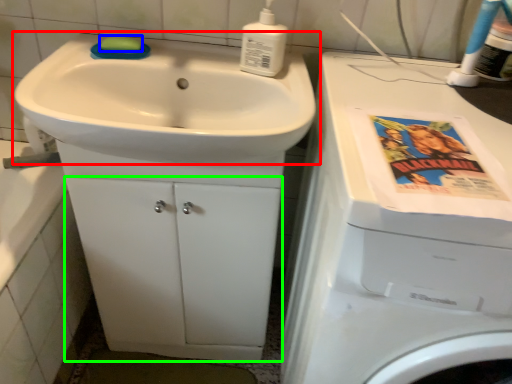
Question: Which is farther away from sink (highlighted by a red box)? soap (highlighted by a blue box) or drawer (highlighted by a green box)?

Choices:
 (A) soap
 (B) drawer

Answer: (B)